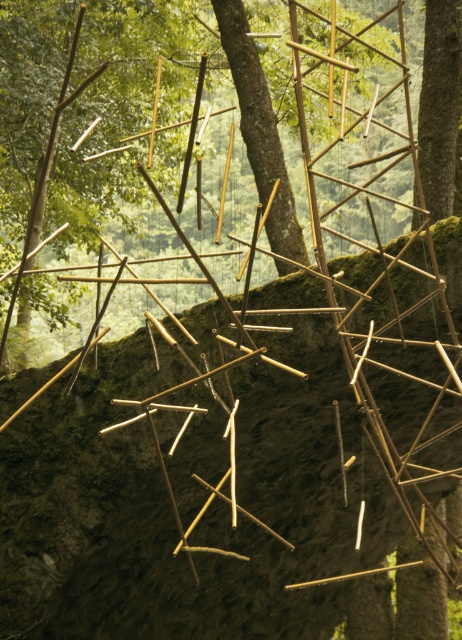
Question: Which object is closer to the camera taking this photo?

Choices:
 (A) brown rough tree trunk at upper right
 (B) brown rough tree trunk at center

Answer: (B)

Question: Which of the following is the closest to the observer?

Choices:
 (A) (249, 74)
 (B) (425, 28)

Answer: (B)

Question: Does brown rough tree trunk at center lie in front of brown rough tree trunk at upper right?

Choices:
 (A) yes
 (B) no

Answer: (A)

Question: Can you confirm if brown rough tree trunk at center is positioned below brown rough tree trunk at upper right?

Choices:
 (A) yes
 (B) no

Answer: (A)

Question: Is brown rough tree trunk at center smaller than brown rough tree trunk at upper right?

Choices:
 (A) no
 (B) yes

Answer: (A)